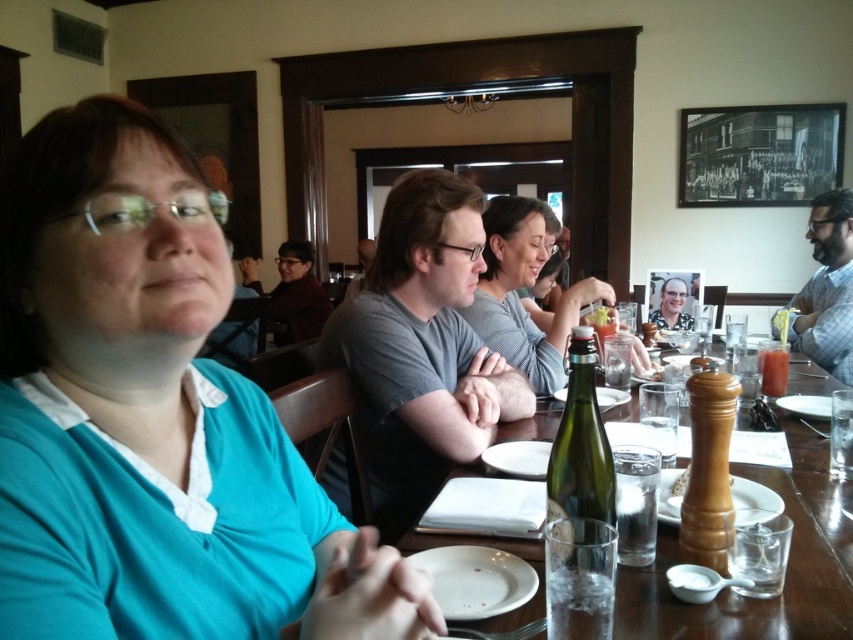
Can you confirm if matte gray sweater at center is thinner than green glass bottle at center?

In fact, matte gray sweater at center might be wider than green glass bottle at center.

Who is more distant from viewer, (604, 298) or (560, 528)?

Positioned behind is point (604, 298).

Is point (489, 269) more distant than point (587, 436)?

That is True.

Find the location of `matte gray sweater at center`. matte gray sweater at center is located at coordinates (523, 288).

Which is in front, point (39, 308) or point (654, 323)?

Point (39, 308)

Can you confirm if teal fabric shirt at center is positioned above matte black glasses at center?

Incorrect, teal fabric shirt at center is not positioned above matte black glasses at center.

Who is more distant from viewer, [155,600] or [674,280]?

The point [674,280] is behind.

The width and height of the screenshot is (853, 640). I want to click on teal fabric shirt at center, so click(x=152, y=417).

Who is higher up, green glass bottle at center or wooden pepper mill at center?

green glass bottle at center is above.

Is green glass bottle at center thinner than wooden pepper mill at center?

No.

In the scene shown: Who is more forward, (601, 536) or (732, 404)?

Point (601, 536)

The width and height of the screenshot is (853, 640). Find the location of `green glass bottle at center`. green glass bottle at center is located at coordinates (579, 474).